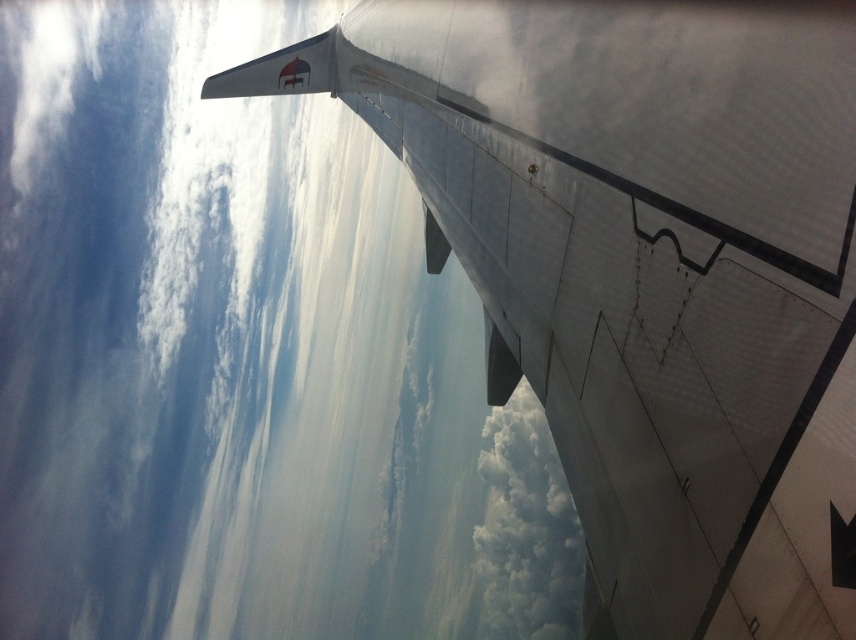
Question: Which point is closer to the camera?

Choices:
 (A) (480, 545)
 (B) (191, 108)

Answer: (B)

Question: Which of the following is the farthest from the observer?

Choices:
 (A) (527, 573)
 (B) (548, 448)
 (C) (789, 70)

Answer: (B)

Question: Can you confirm if white matte wing at upper center is positioned to the right of metallic silver wing at upper right?

Choices:
 (A) yes
 (B) no

Answer: (B)

Question: Which of the following is the farthest from the observer?

Choices:
 (A) white matte wing at upper center
 (B) metallic silver wing at upper right

Answer: (A)

Question: Does white matte wing at upper center have a lesser width compared to white fluffy cloud at upper center?

Choices:
 (A) no
 (B) yes

Answer: (A)

Question: Does white matte wing at upper center have a greater width compared to white fluffy cloud at upper center?

Choices:
 (A) no
 (B) yes

Answer: (B)